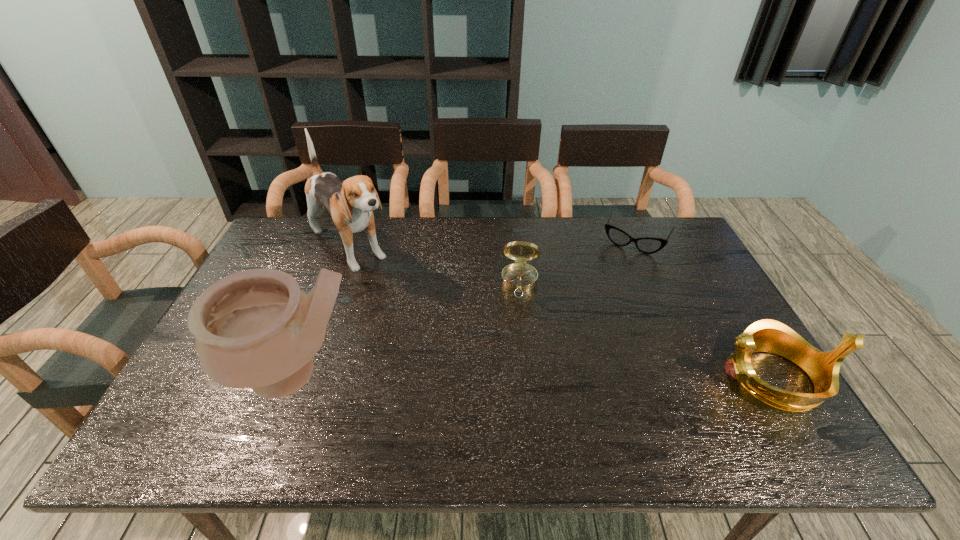
At what (x,y) coordinates should I click in order to perform the action: click on free space between the puppy and the shortest object. Please return your answer as a coordinate pair (x, y). Looking at the image, I should click on (492, 244).

I want to click on unoccupied position between the tiara and the puppy, so click(x=562, y=313).

What are the coordinates of `vacant space that's between the third object from left to right and the tiara` in the screenshot? It's located at (647, 330).

You are a GUI agent. You are given a task and a screenshot of the screen. Output one action in this format:
    pyautogui.click(x=<x>, y=<y>)
    Task: Click on the unoccupied area between the puppy and the tiara
    
    Given the screenshot: What is the action you would take?
    pyautogui.click(x=562, y=313)

Identify the location of free space between the pottery and the tiara. (535, 376).

Identify the location of free space that is in between the compass and the pottery. The height and width of the screenshot is (540, 960). (408, 328).

Identify the location of object that can be found as the fourth closest to the pottery. This screenshot has width=960, height=540. (767, 335).

The height and width of the screenshot is (540, 960). Find the location of `object identified as the fourth closest to the puppy`. object identified as the fourth closest to the puppy is located at coordinates (767, 335).

At what (x,y) coordinates should I click in order to perform the action: click on free space in the image that satisfies the following two spatial constraints: 1. on the front side of the pottery; 2. at the front emblem of the tiara. Please return your answer as a coordinate pair (x, y). Looking at the image, I should click on (295, 378).

I want to click on vacant space that satisfies the following two spatial constraints: 1. on the front side of the pottery; 2. at the front emblem of the tiara, so click(295, 378).